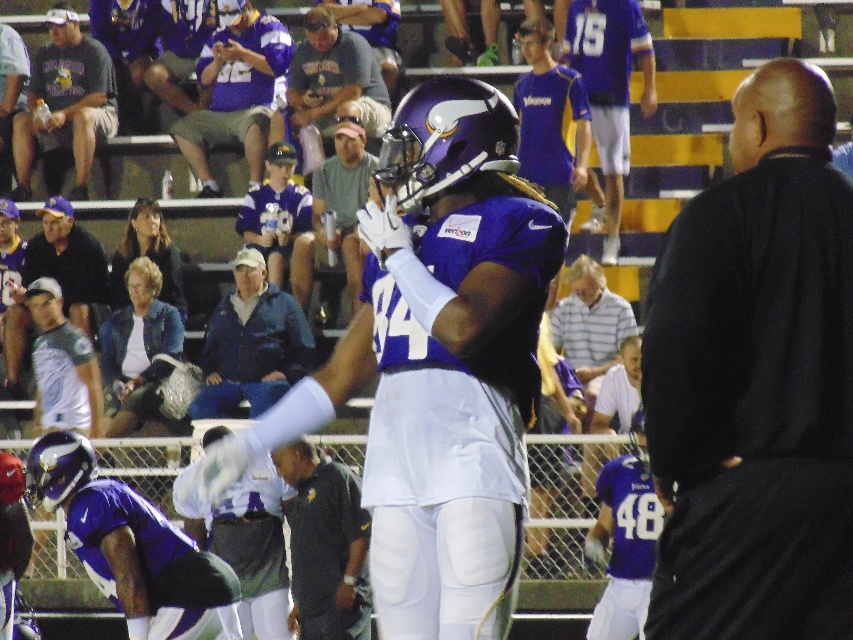
Question: Does gray fabric cap at upper left appear on the right side of matte black helmet at upper left?

Choices:
 (A) yes
 (B) no

Answer: (A)

Question: Is blue denim jacket at center closer to camera compared to gray fabric cap at upper left?

Choices:
 (A) no
 (B) yes

Answer: (B)

Question: Can you confirm if black smooth shirt at right is wider than gray fabric cap at upper left?

Choices:
 (A) no
 (B) yes

Answer: (A)

Question: Which point is farther to the camera?

Choices:
 (A) (534, 390)
 (B) (325, 483)
 (C) (242, 572)

Answer: (C)

Question: Considering the real-world distances, which object is farthest from the matte purple jersey at upper center?

Choices:
 (A) matte black helmet at upper left
 (B) matte purple helmet at lower left

Answer: (B)

Question: Which object is the farthest from the gray fabric camera at upper center?

Choices:
 (A) matte purple jersey at center
 (B) matte blue jersey at upper right

Answer: (A)